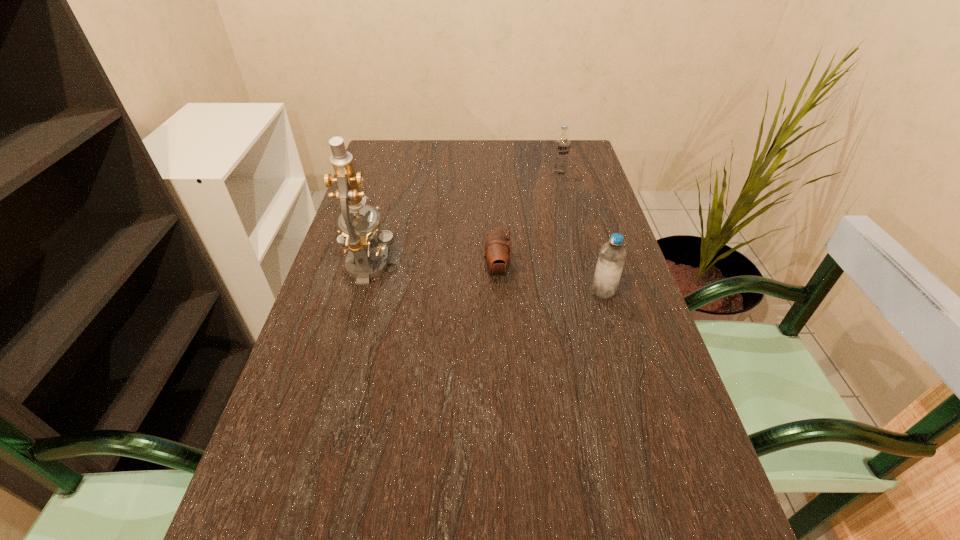
I want to click on vacant space at the far left corner of the desktop, so click(x=376, y=142).

The width and height of the screenshot is (960, 540). What are the coordinates of `free point between the tallest object and the water bottle` in the screenshot? It's located at (487, 279).

This screenshot has width=960, height=540. I want to click on vacant space that is in between the water bottle and the leftmost object, so click(487, 279).

The width and height of the screenshot is (960, 540). In order to click on vacant region between the vodka and the leftmost object in this screenshot , I will do `click(464, 220)`.

At what (x,y) coordinates should I click in order to perform the action: click on vacant point located between the water bottle and the vodka. Please return your answer as a coordinate pair (x, y). This screenshot has width=960, height=540. Looking at the image, I should click on (581, 233).

Where is `free space between the microscope and the water bottle`? This screenshot has width=960, height=540. free space between the microscope and the water bottle is located at coordinates (487, 279).

Where is `empty location between the pouch and the microscope`? This screenshot has height=540, width=960. empty location between the pouch and the microscope is located at coordinates (433, 268).

This screenshot has height=540, width=960. I want to click on vacant space that is in between the water bottle and the second object from left to right, so click(550, 281).

At what (x,y) coordinates should I click in order to perform the action: click on empty space between the pouch and the tallest object. Please return your answer as a coordinate pair (x, y). The image size is (960, 540). Looking at the image, I should click on (433, 268).

Identify the location of empty location between the third object from right to left and the water bottle. (550, 281).